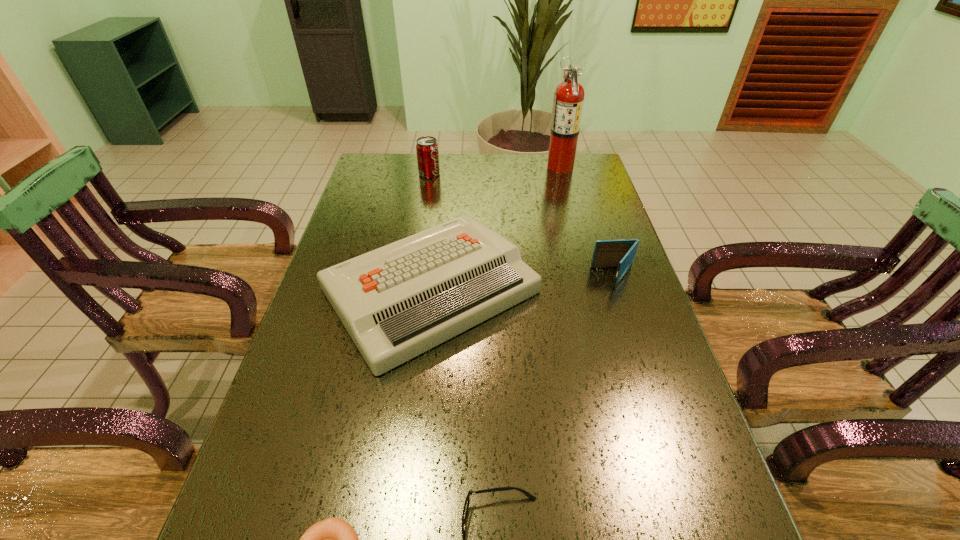
This screenshot has height=540, width=960. Find the location of `free location located on the exterior surface of the wallet`. free location located on the exterior surface of the wallet is located at coordinates (516, 278).

You are a GUI agent. You are given a task and a screenshot of the screen. Output one action in this format:
    pyautogui.click(x=<x>, y=<y>)
    Task: Click on the vacant area situated 0.050m on the back of the computer keyboard
    
    Given the screenshot: What is the action you would take?
    pyautogui.click(x=438, y=217)

Find the location of a particular element. The height and width of the screenshot is (540, 960). fire extinguisher that is at the far edge is located at coordinates (568, 100).

Where is `pop soda that is at the far edge`? The image size is (960, 540). pop soda that is at the far edge is located at coordinates (427, 151).

Identify the location of object at the left edge. (396, 302).

Find the location of a particular element. The height and width of the screenshot is (540, 960). fire extinguisher that is at the right edge is located at coordinates (568, 100).

The image size is (960, 540). Identify the location of wallet that is at the right edge. (607, 253).

The width and height of the screenshot is (960, 540). I want to click on object that is at the far right corner, so click(x=568, y=100).

Where is `free space at the far edge of the desktop`? free space at the far edge of the desktop is located at coordinates (534, 162).

Find the location of a particular element. This screenshot has width=960, height=540. vacant space at the left edge of the desktop is located at coordinates (379, 224).